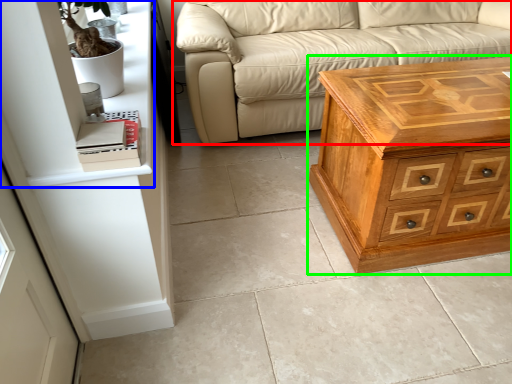
Question: Estimate the real-world distances between objects in this image. Which object is farther from studio couch (highlighted by a red box), shelf (highlighted by a blue box) or chest of drawers (highlighted by a green box)?

Choices:
 (A) shelf
 (B) chest of drawers

Answer: (A)